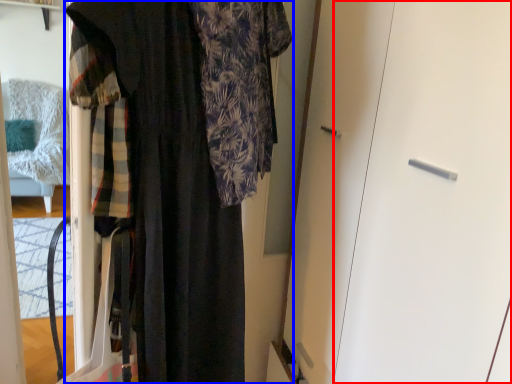
Question: Which point is further to the camera, screen door (highlighted by a red box) or fancy dress (highlighted by a blue box)?

Choices:
 (A) screen door
 (B) fancy dress

Answer: (A)